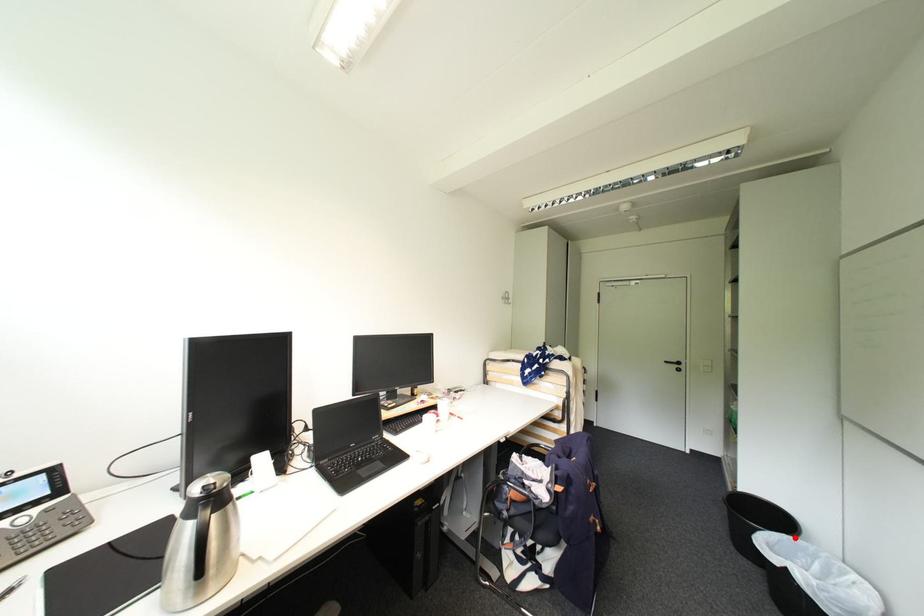
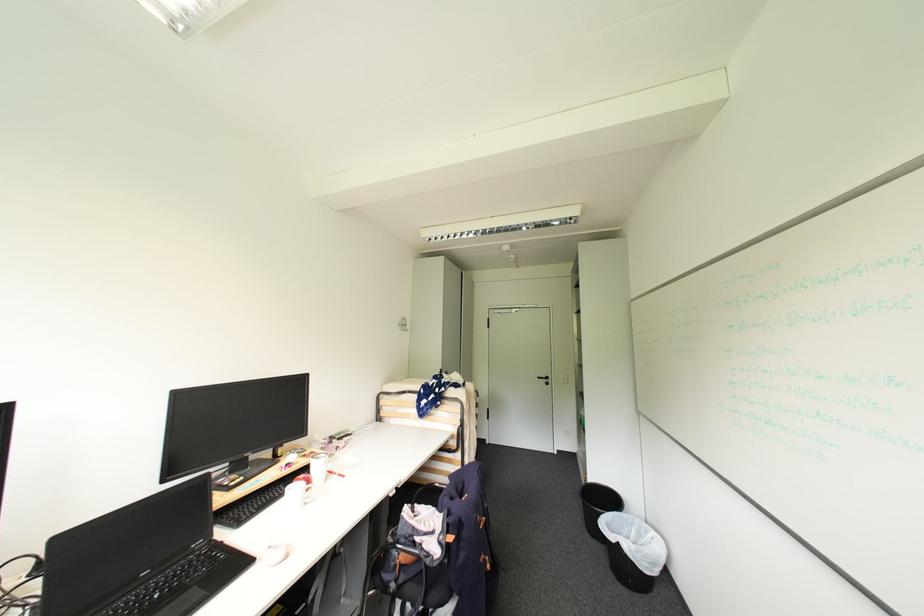
Where in the second image is the point corresponding to the highlighted location from the first image?

(624, 514)